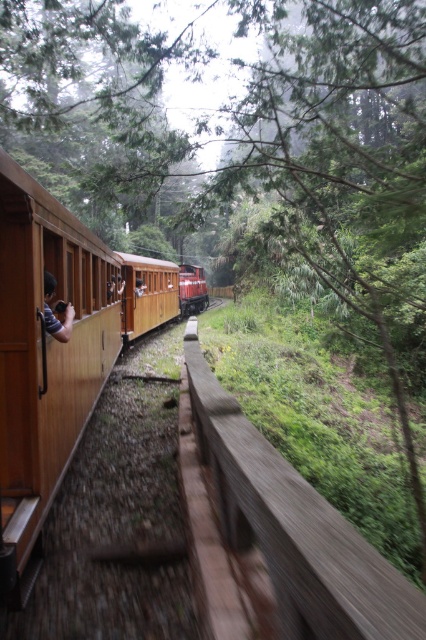
You are standing at the point labeled as point (x=294, y=529) in the image. What object are you standing on?

You are standing on the brown wooden rail at center.

You are a passenger sitting inside the train and looking out the window. You see the matte red train car at center and the brown wooden person at left. Which object is closer to your left side?

The brown wooden person at left is closer to your left side because it is positioned to the left of the matte red train car at center.